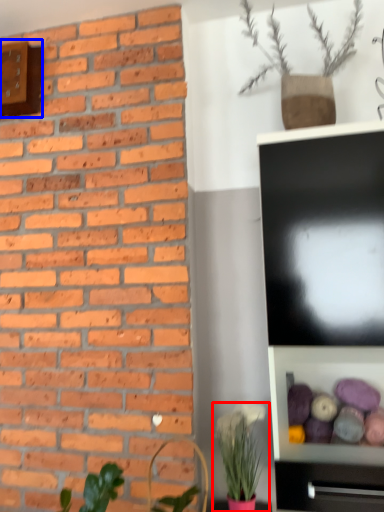
Question: Which object appears farthest to the camera in this image, houseplant (highlighted by a red box) or clock (highlighted by a blue box)?

Choices:
 (A) houseplant
 (B) clock

Answer: (B)